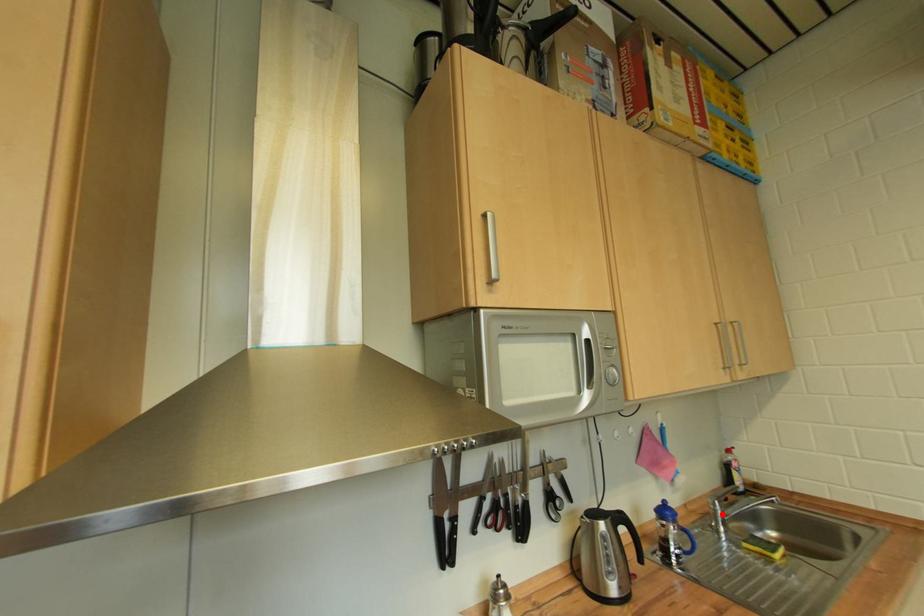
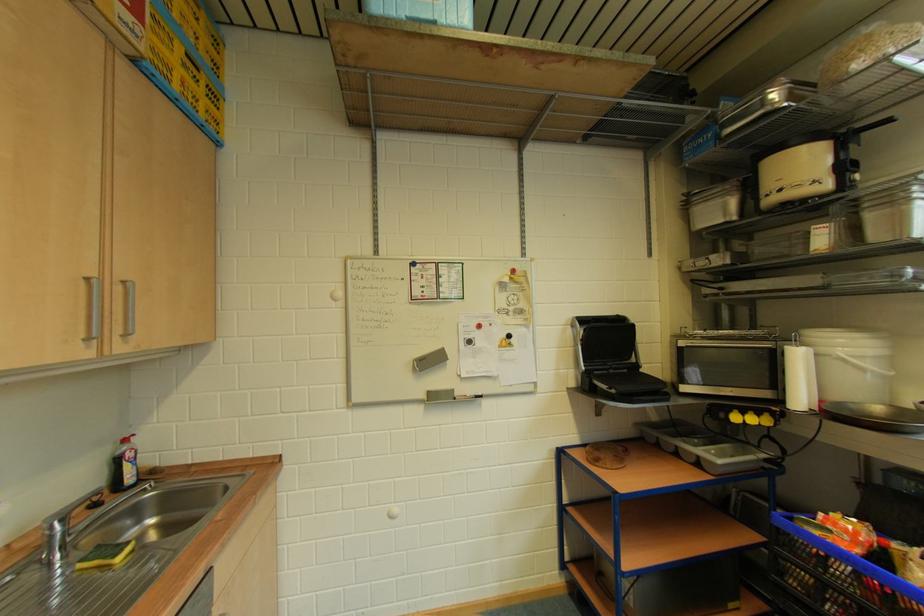
Question: I am providing you with two images of the same scene from different viewpoints. A red point is marked on the first image. Can you still see the location of the red point in image 2?

Choices:
 (A) Yes
 (B) No

Answer: (A)